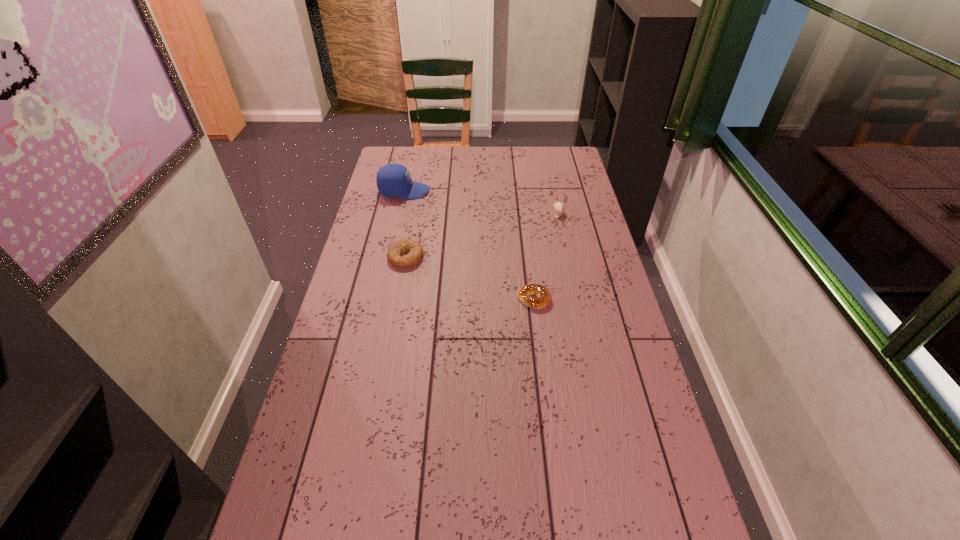
Where is `vacant position located 0.350m on the right of the left bagel`? vacant position located 0.350m on the right of the left bagel is located at coordinates (522, 257).

This screenshot has height=540, width=960. I want to click on vacant region located on the left of the nearer bagel, so click(x=458, y=299).

This screenshot has height=540, width=960. In order to click on cap located in the left edge section of the desktop in this screenshot , I will do `click(393, 180)`.

This screenshot has height=540, width=960. I want to click on bagel that is at the left edge, so click(394, 253).

Identify the location of object positioned at the right edge. Image resolution: width=960 pixels, height=540 pixels. (559, 207).

In the image, there is a desktop. Where is `vacant space at the far edge`? The image size is (960, 540). vacant space at the far edge is located at coordinates (426, 170).

Where is `vacant space at the left edge of the desktop`? This screenshot has height=540, width=960. vacant space at the left edge of the desktop is located at coordinates (288, 470).

The width and height of the screenshot is (960, 540). In the image, there is a desktop. Identify the location of vacant area at the right edge. (585, 372).

In the image, there is a desktop. Where is `free region at the far left corner`? This screenshot has width=960, height=540. free region at the far left corner is located at coordinates (407, 163).

You are a GUI agent. You are given a task and a screenshot of the screen. Output one action in this format:
    pyautogui.click(x=<x>, y=<y>)
    Task: Click on the vacant space that is in between the farthest object and the farther bagel
    This screenshot has width=960, height=540.
    Given the screenshot: What is the action you would take?
    pyautogui.click(x=405, y=224)